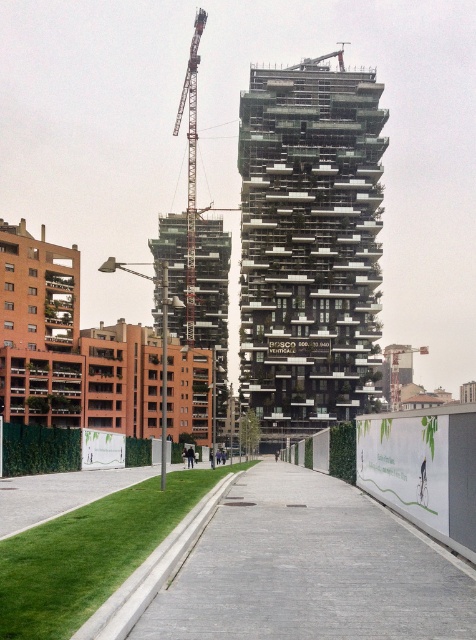
Question: Does green glass building at center appear on the left side of metallic gray crane at upper center?

Choices:
 (A) yes
 (B) no

Answer: (B)

Question: Considering the real-world distances, which object is farthest from the glassy concrete tower at center?

Choices:
 (A) green grass at lower left
 (B) green glass building at center

Answer: (A)

Question: Is glassy concrete tower at center smaller than metallic gray crane at upper center?

Choices:
 (A) no
 (B) yes

Answer: (B)

Question: Which of these objects is positioned farthest from the glassy concrete tower at center?

Choices:
 (A) metallic gray crane at upper center
 (B) green glass building at center
 (C) gray concrete pavement at center
 (D) green grass at lower left

Answer: (D)

Question: Can you confirm if green glass building at center is bigger than green grass at lower left?

Choices:
 (A) yes
 (B) no

Answer: (A)

Question: Which point appears farthest from the camera in this image?

Choices:
 (A) (196, 51)
 (B) (355, 339)
 (C) (247, 618)

Answer: (A)